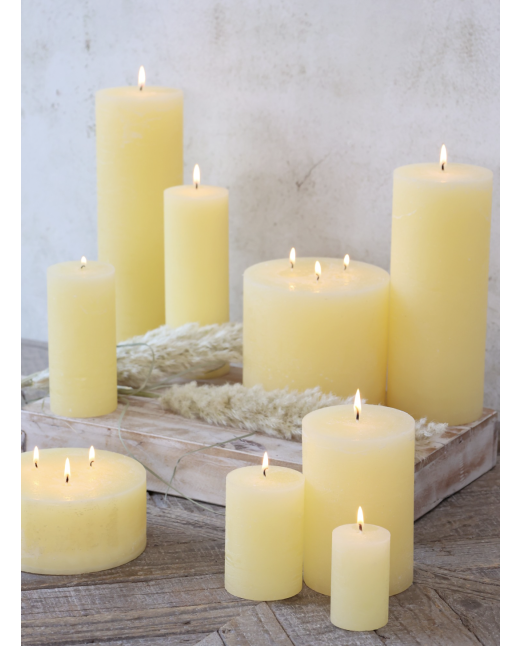
At what (x,y) coordinates should I click in order to perform the action: click on short candles. Please return your answer as a coordinate pair (x, y). The height and width of the screenshot is (646, 520). Looking at the image, I should click on (359, 570), (255, 534), (85, 517), (330, 326).